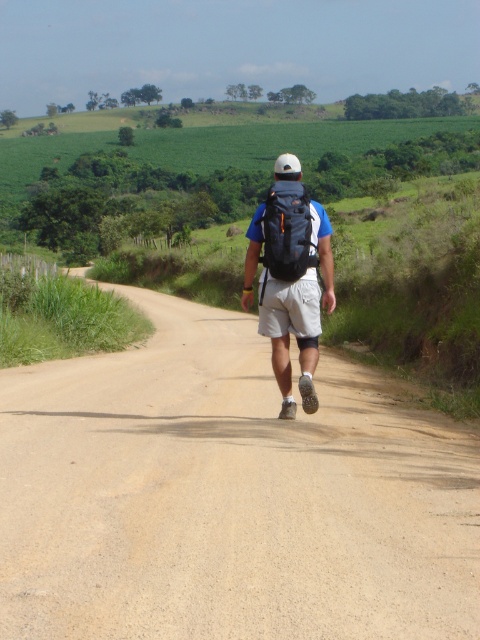
You are a hiker who wants to ensure your backpack is the tallest one. You have a matte black backpack at center and an orange mesh backpack at center. Which backpack should you choose?

The matte black backpack at center has a greater height compared to the orange mesh backpack at center, so you should choose the matte black backpack at center to have the tallest one.

You are standing at the starting point of the dirt road and want to walk towards the hills in the background. Which direction should you head relative to the brown gravel road at center?

You should head towards the hills by following the brown gravel road at center, which curves gently to the left as it stretches into the distance.

You are a hiker who wants to follow the path ahead. There is a brown gravel road at center and a matte black backpack at center. Which object should you follow to stay on the correct path?

You should follow the brown gravel road at center to stay on the correct path because it is positioned on the left side of the matte black backpack at center, indicating the road leads the way.